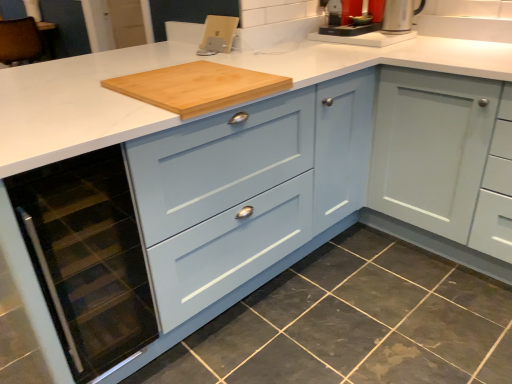
Question: Is dark gray granite at lower left at the left side of silver metallic coffee machine at upper center?

Choices:
 (A) yes
 (B) no

Answer: (A)

Question: Is the position of dark gray granite at lower left more distant than that of silver metallic coffee machine at upper center?

Choices:
 (A) yes
 (B) no

Answer: (B)

Question: From a real-world perspective, is dark gray granite at lower left located higher than silver metallic coffee machine at upper center?

Choices:
 (A) no
 (B) yes

Answer: (A)

Question: Would you say dark gray granite at lower left contains silver metallic coffee machine at upper center?

Choices:
 (A) yes
 (B) no

Answer: (B)

Question: Is dark gray granite at lower left shorter than silver metallic coffee machine at upper center?

Choices:
 (A) yes
 (B) no

Answer: (A)

Question: Considering their positions, is silver metallic coffee machine at upper center located in front of or behind silver metallic kettle at upper right?

Choices:
 (A) behind
 (B) front

Answer: (A)

Question: Based on their positions, is silver metallic coffee machine at upper center located to the left or right of silver metallic kettle at upper right?

Choices:
 (A) left
 (B) right

Answer: (A)

Question: From the image's perspective, is silver metallic coffee machine at upper center above or below silver metallic kettle at upper right?

Choices:
 (A) above
 (B) below

Answer: (A)

Question: Considering the positions of silver metallic coffee machine at upper center and silver metallic kettle at upper right in the image, is silver metallic coffee machine at upper center bigger or smaller than silver metallic kettle at upper right?

Choices:
 (A) small
 (B) big

Answer: (B)

Question: From the image's perspective, relative to light blue wood cabinet at center, is dark gray granite at lower left above or below?

Choices:
 (A) below
 (B) above

Answer: (A)

Question: Considering the positions of dark gray granite at lower left and light blue wood cabinet at center in the image, is dark gray granite at lower left bigger or smaller than light blue wood cabinet at center?

Choices:
 (A) big
 (B) small

Answer: (B)

Question: Based on their positions, is dark gray granite at lower left located to the left or right of light blue wood cabinet at center?

Choices:
 (A) left
 (B) right

Answer: (B)

Question: Choose the correct answer: Is dark gray granite at lower left inside light blue wood cabinet at center or outside it?

Choices:
 (A) outside
 (B) inside

Answer: (A)

Question: In terms of height, does light blue wood cabinet at center look taller or shorter compared to dark gray granite at lower left?

Choices:
 (A) short
 (B) tall

Answer: (B)

Question: From the image's perspective, relative to dark gray granite at lower left, is light blue wood cabinet at center above or below?

Choices:
 (A) above
 (B) below

Answer: (A)